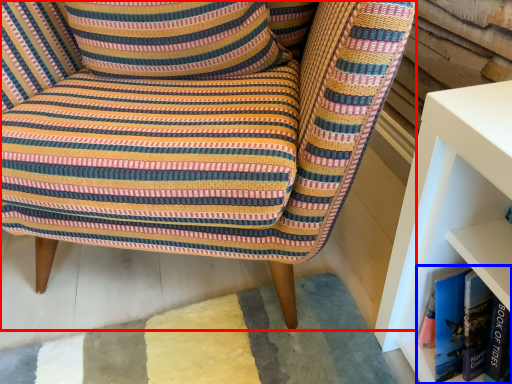
Question: Among these objects, which one is nearest to the camera, chair (highlighted by a red box) or book (highlighted by a blue box)?

Choices:
 (A) chair
 (B) book

Answer: (A)